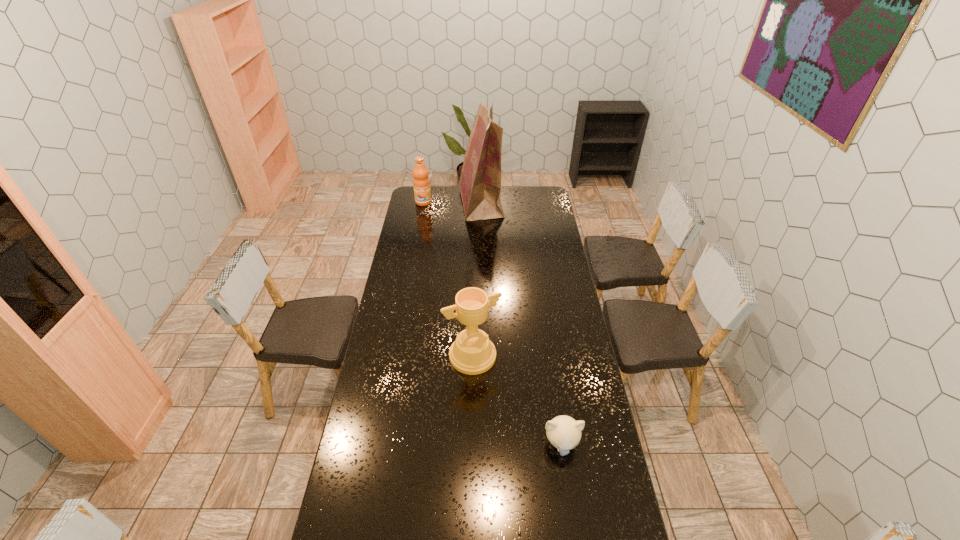
Image resolution: width=960 pixels, height=540 pixels. I want to click on free spot between the fruit juice and the shortest object, so click(x=492, y=323).

Locate an element on the screen. The image size is (960, 540). unoccupied position between the grocery bag and the second nearest object is located at coordinates (477, 280).

You are a GUI agent. You are given a task and a screenshot of the screen. Output one action in this format:
    pyautogui.click(x=<x>, y=<y>)
    Task: Click on the vacant region between the award and the tallest object
    The image size is (960, 540).
    Given the screenshot: What is the action you would take?
    pyautogui.click(x=477, y=280)

The image size is (960, 540). I want to click on free space that is in between the second nearest object and the rightmost object, so click(x=516, y=400).

The width and height of the screenshot is (960, 540). Identify the location of empty space between the kitten and the leftmost object. (492, 323).

The image size is (960, 540). I want to click on vacant point located between the shortest object and the award, so click(x=516, y=400).

Where is `free space between the nearest object and the leftmost object`? free space between the nearest object and the leftmost object is located at coordinates (492, 323).

You are a GUI agent. You are given a task and a screenshot of the screen. Output one action in this format:
    pyautogui.click(x=<x>, y=<y>)
    Task: Click on the free area in between the third farthest object and the tallest object
    
    Given the screenshot: What is the action you would take?
    pyautogui.click(x=477, y=280)

This screenshot has height=540, width=960. I want to click on vacant point located between the fruit juice and the award, so click(x=448, y=279).

Identify the location of empty space between the rightmost object and the tallest object. This screenshot has height=540, width=960. (521, 324).